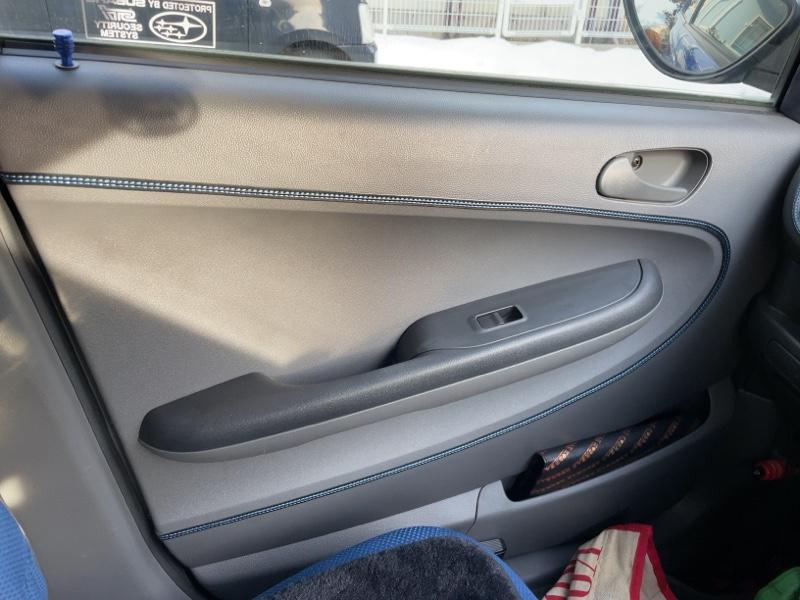
This screenshot has width=800, height=600. Identify the location of storage pocket. (530, 483).